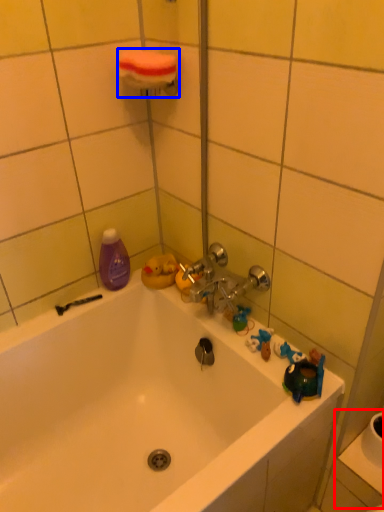
Question: Among these objects, which one is nearest to the camera, sink (highlighted by a red box) or towel bar (highlighted by a blue box)?

Choices:
 (A) sink
 (B) towel bar

Answer: (B)